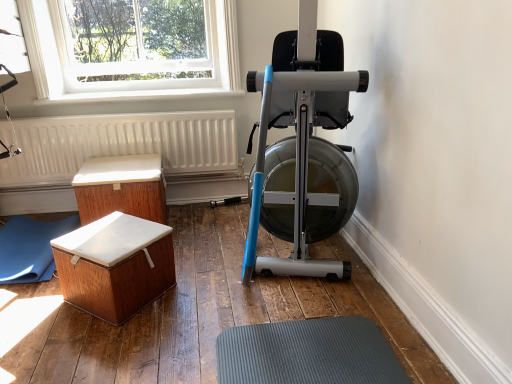
Identify the location of vacant space in front of wooden chest at lower left, marked as the 2th furniture in a back-to-front arrangement. The image size is (512, 384). (97, 350).